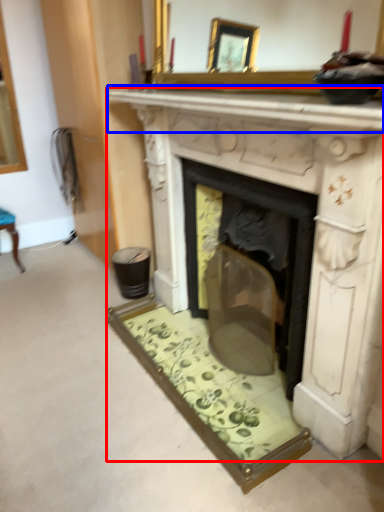
Question: Among these objects, which one is farthest to the camera, fireplace (highlighted by a red box) or mantle (highlighted by a blue box)?

Choices:
 (A) fireplace
 (B) mantle

Answer: (A)